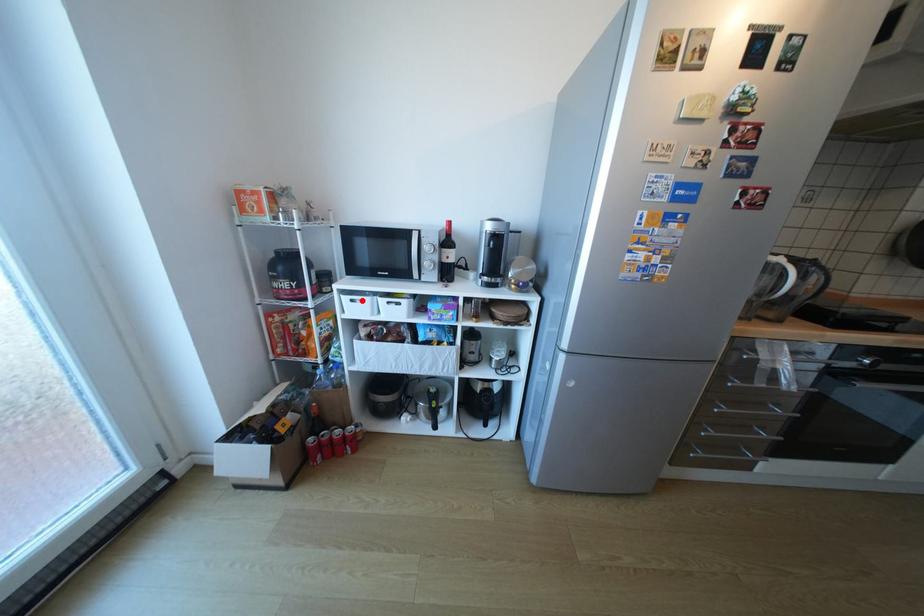
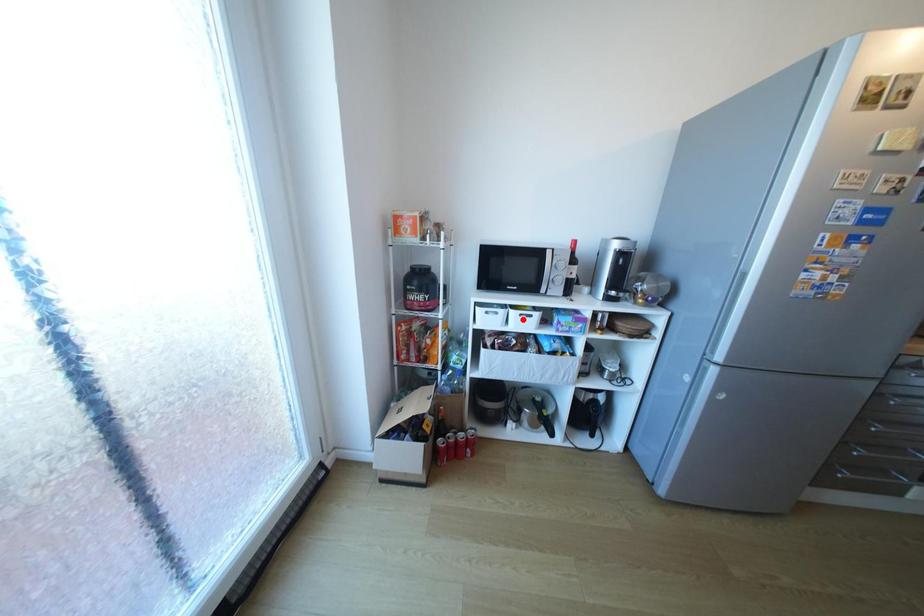
I am providing you with two images of the same scene from different viewpoints. A red point is marked on the first image and another point is marked on the second image. Do the highlighted points in image1 and image2 indicate the same real-world spot?

No